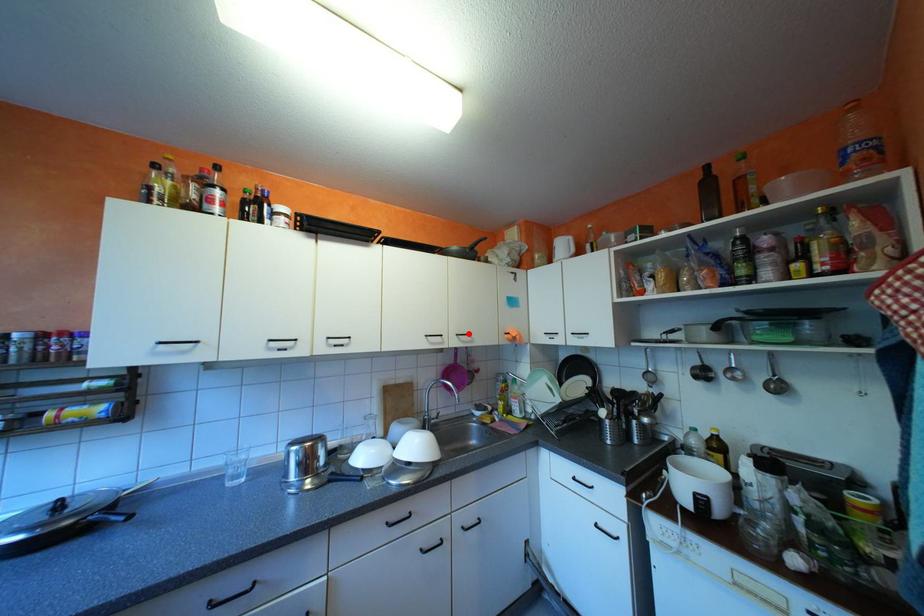
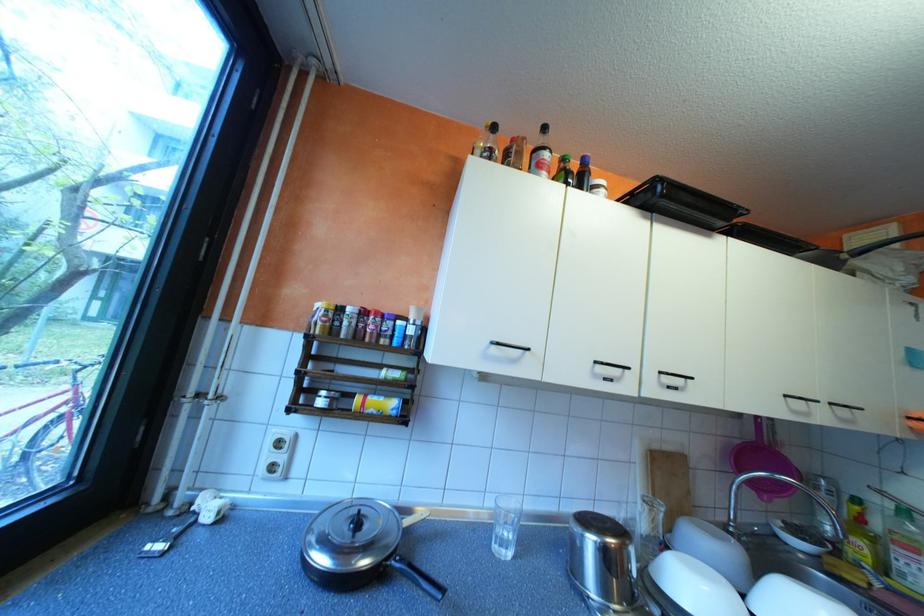
Locate, in the second image, the point that corresponds to the highlighted location in the first image.

(843, 403)